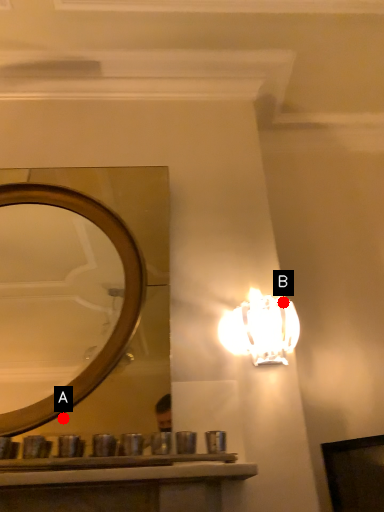
Question: Two points are circled on the image, labeled by A and B beside each circle. Which point is further to the camera?

Choices:
 (A) A is further
 (B) B is further

Answer: (B)